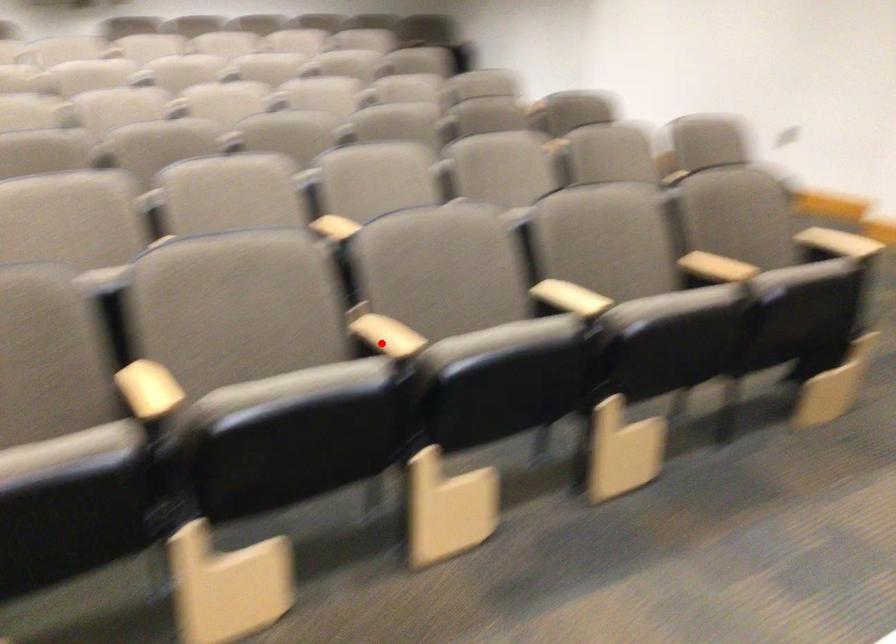
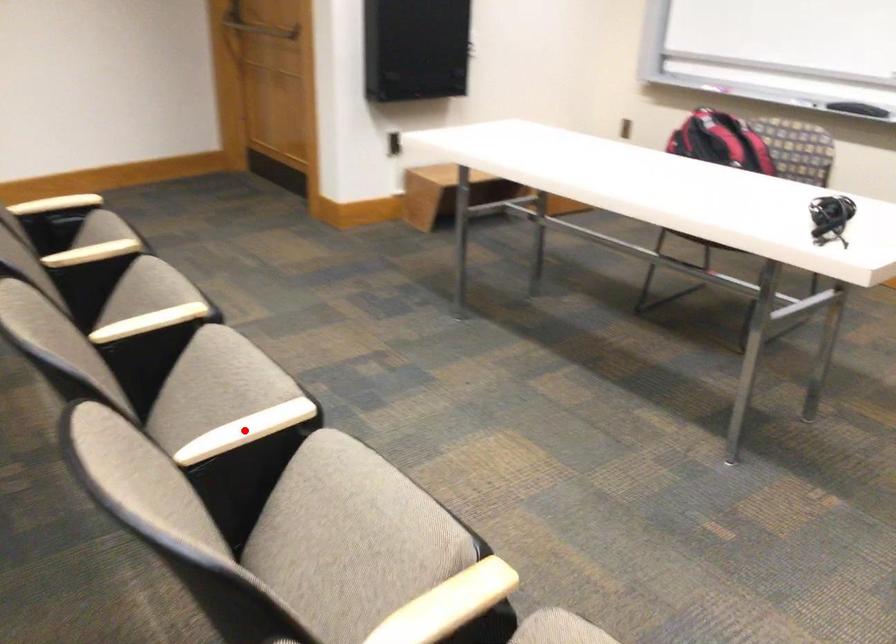
I am providing you with two images of the same scene from different viewpoints. A red point is marked on the first image and another point is marked on the second image. Do the highlighted points in image1 and image2 indicate the same real-world spot?

Yes